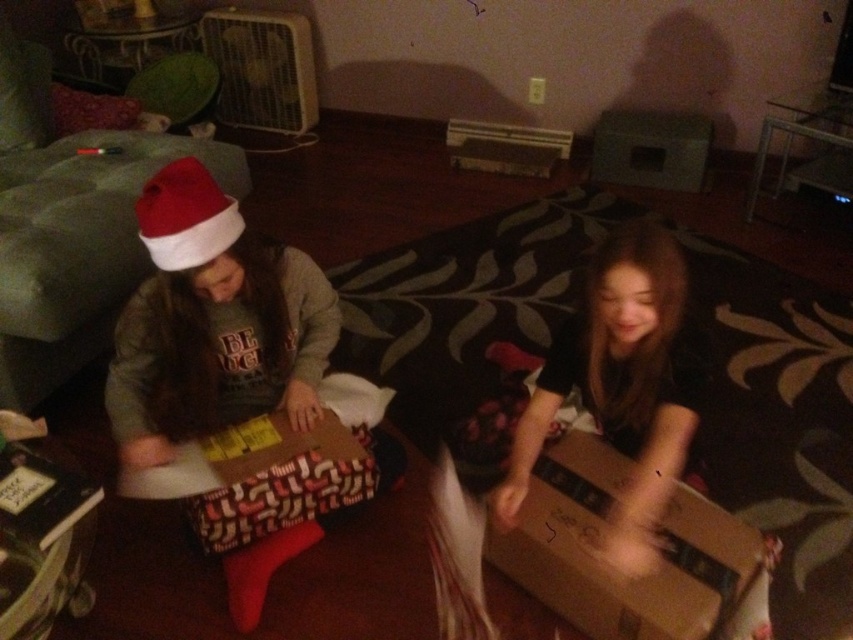
Who is taller, brown cardboard box at lower right or red matte santa hat at upper left?

brown cardboard box at lower right

Can you confirm if brown cardboard box at lower right is taller than red matte santa hat at upper left?

Indeed, brown cardboard box at lower right has a greater height compared to red matte santa hat at upper left.

The image size is (853, 640). Find the location of `brown cardboard box at lower right`. brown cardboard box at lower right is located at coordinates (612, 572).

Where is `brown cardboard box at lower right`? The width and height of the screenshot is (853, 640). brown cardboard box at lower right is located at coordinates (612, 572).

Based on the photo, does matte gray sweater at center appear under red matte santa hat at upper left?

Correct, matte gray sweater at center is located below red matte santa hat at upper left.

Is point (253, 268) in front of point (198, 163)?

No, (253, 268) is behind (198, 163).

Find the location of `matte gray sweater at center`. matte gray sweater at center is located at coordinates (213, 324).

Does matte gray sweater at center have a lesser width compared to brown cardboard box at lower right?

No, matte gray sweater at center is not thinner than brown cardboard box at lower right.

Find the location of a particular element. The image size is (853, 640). matte gray sweater at center is located at coordinates (213, 324).

Is point (120, 397) in front of point (675, 556)?

No.

The height and width of the screenshot is (640, 853). Identify the location of matte gray sweater at center. (213, 324).